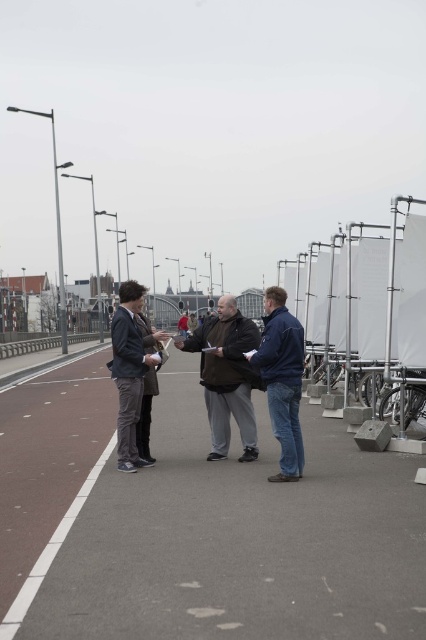
In the scene shown: Between dark blue jacket at center and dark gray jacket at center, which one has more height?

With more height is dark gray jacket at center.

Does point (293, 390) come closer to viewer compared to point (112, 364)?

Yes, point (293, 390) is in front of point (112, 364).

Find the location of a particular element. This screenshot has width=426, height=640. dark blue jacket at center is located at coordinates (282, 380).

This screenshot has width=426, height=640. What do you see at coordinates (227, 376) in the screenshot?
I see `dark brown leather jacket at center` at bounding box center [227, 376].

Is dark brown leather jacket at center positioned in front of matte black hand at center?

Yes.

Is point (241, 353) positioned before point (158, 339)?

Yes, it is in front of point (158, 339).

Locate an element on the screen. This screenshot has width=426, height=640. dark brown leather jacket at center is located at coordinates (227, 376).

Is dark blue jacket at center shorter than matte black glove at center?

No.

Is point (291, 394) farther from camera compared to point (152, 353)?

No, (291, 394) is closer to viewer.

Does point (296, 376) come in front of point (155, 360)?

Yes, point (296, 376) is closer to viewer.

The height and width of the screenshot is (640, 426). Find the location of `dark blue jacket at center`. dark blue jacket at center is located at coordinates (282, 380).